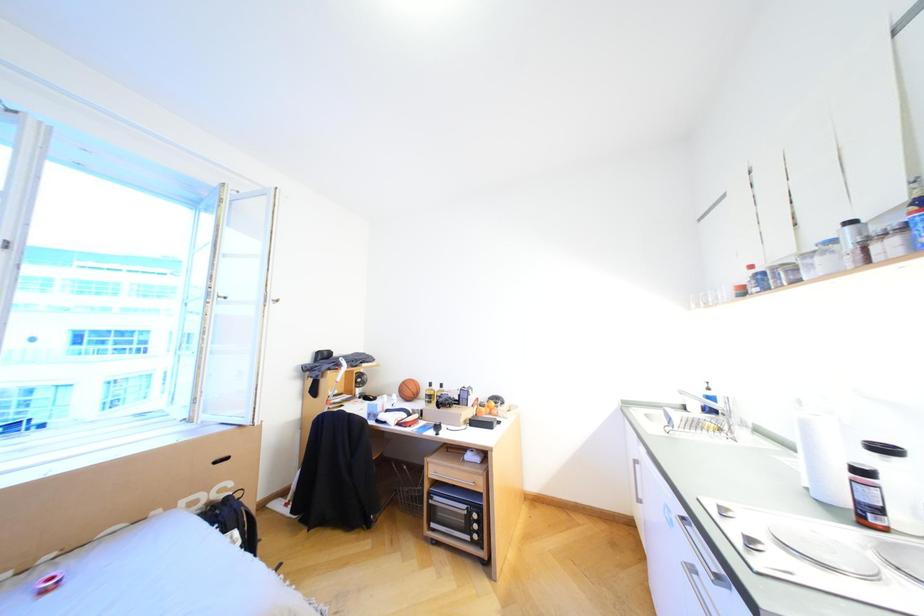
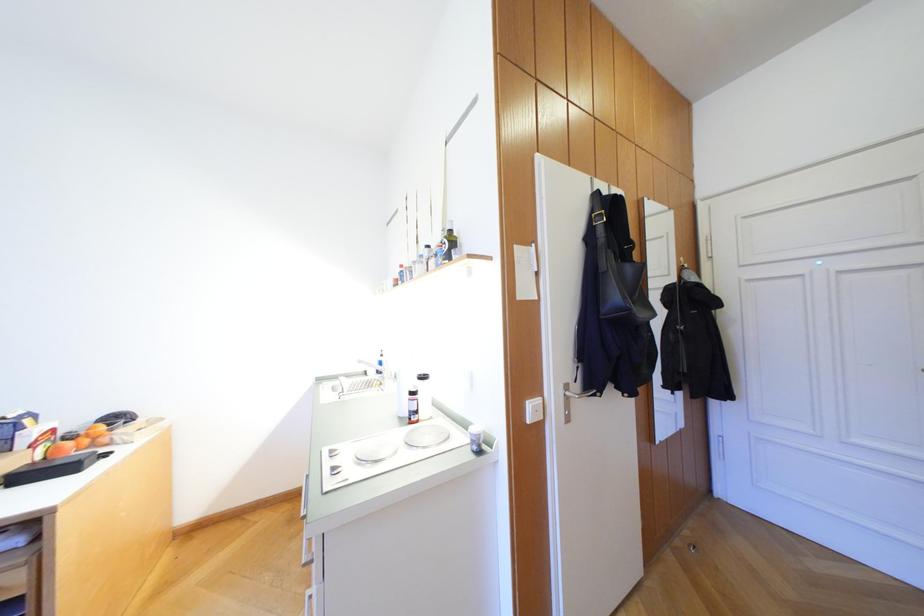
Question: How did the camera likely rotate?

Choices:
 (A) Left
 (B) Right
 (C) Up
 (D) Down

Answer: (B)